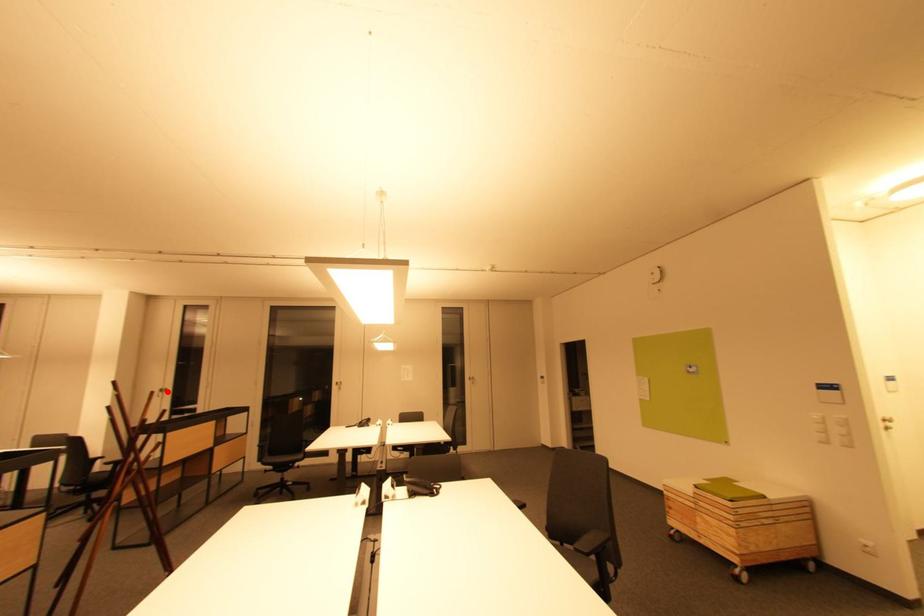
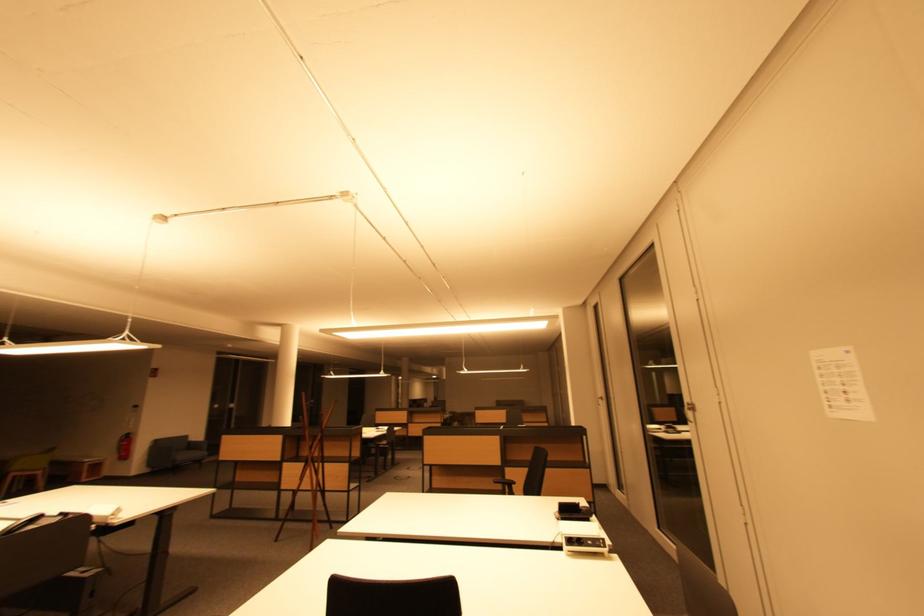
Locate, in the second image, the point that corresponds to the highlighted location in the first image.

(605, 400)